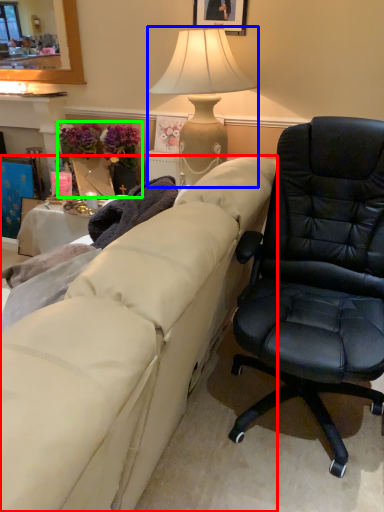
Question: Based on their relative distances, which object is nearer to studio couch (highlighted by a red box)? Choose from lamp (highlighted by a blue box) and houseplant (highlighted by a green box).

Choices:
 (A) lamp
 (B) houseplant

Answer: (A)